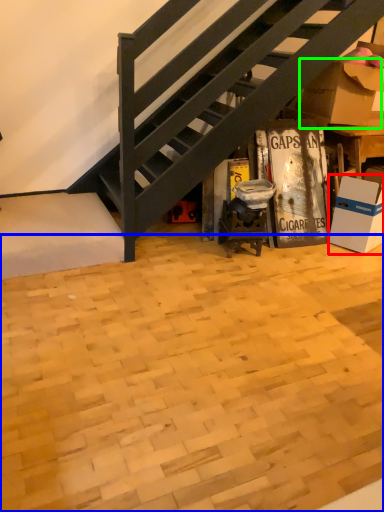
Question: Considering the real-world distances, which object is farthest from box (highlighted by a red box)? plywood (highlighted by a blue box) or cardboard box (highlighted by a green box)?

Choices:
 (A) plywood
 (B) cardboard box

Answer: (A)